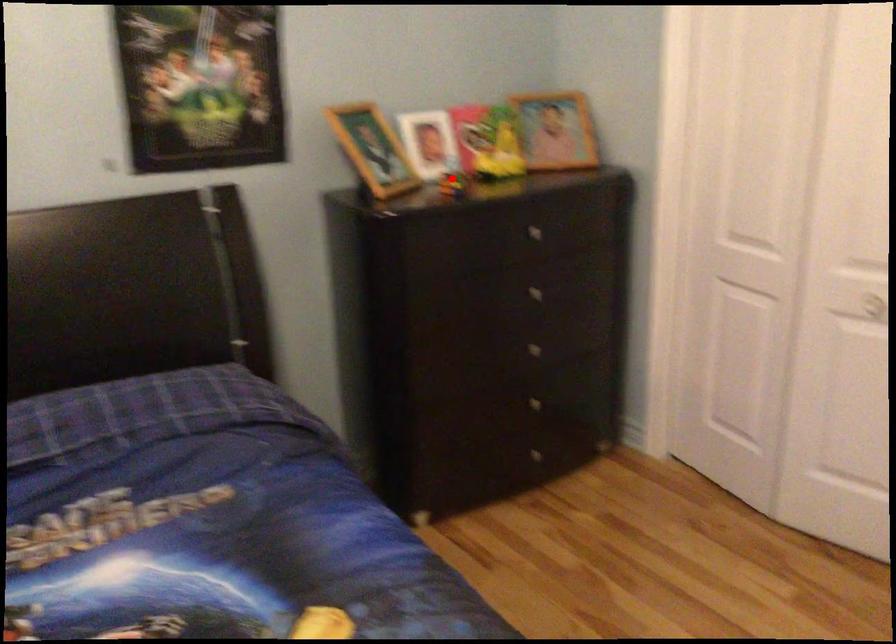
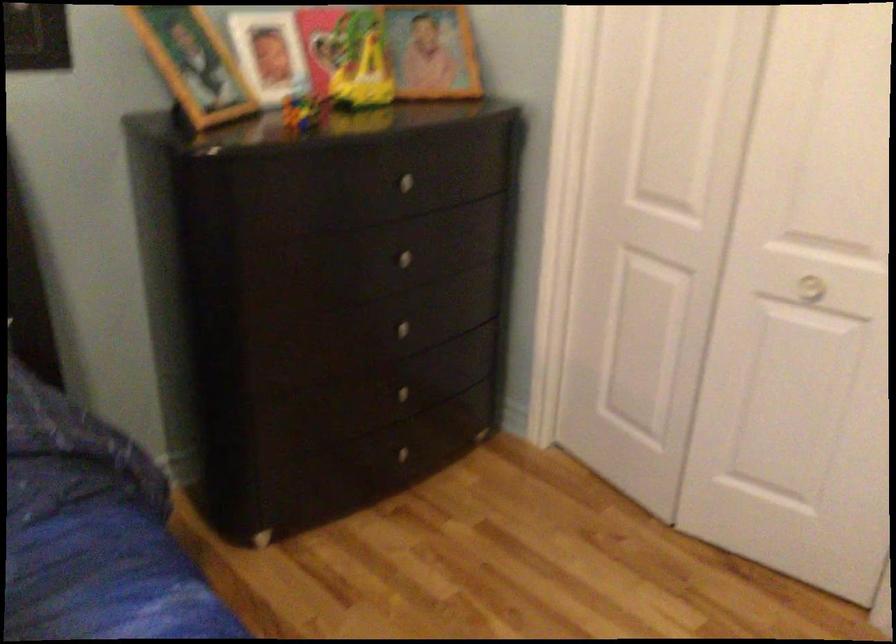
Where in the second image is the point corresponding to the highlighted location from the first image?

(303, 111)